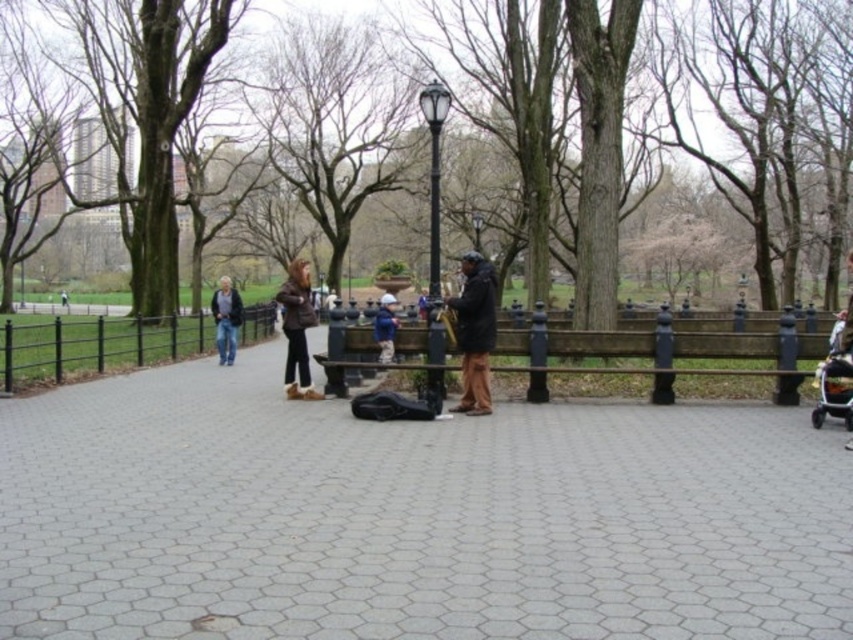
Question: Does black metal fence at left come behind blue denim jacket at center?

Choices:
 (A) no
 (B) yes

Answer: (A)

Question: Considering the real-world distances, which object is farthest from the gray concrete pavement at center?

Choices:
 (A) brown fuzzy jacket at center
 (B) blue denim jacket at center

Answer: (B)

Question: Which point is closer to the camera?

Choices:
 (A) (158, 632)
 (B) (218, 336)
 (C) (523, 352)

Answer: (A)

Question: Is gray concrete pavement at center positioned before black plastic baby carriage at lower right?

Choices:
 (A) no
 (B) yes

Answer: (B)

Question: Which object is the closest to the gray concrete pavement at center?

Choices:
 (A) brown wooden bench at center
 (B) brown bark tree at upper center
 (C) black plastic baby carriage at lower right

Answer: (C)

Question: Can you confirm if jeans at center is wider than blue denim jacket at center?

Choices:
 (A) yes
 (B) no

Answer: (B)